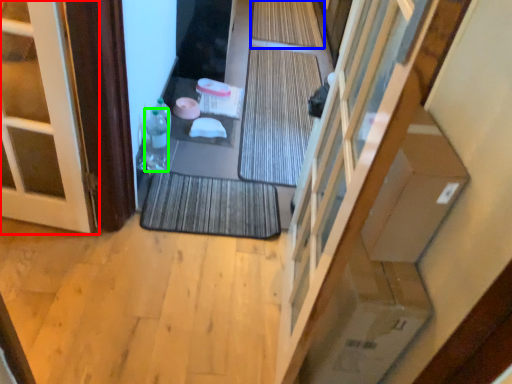
Question: Which object is positioned closest to door (highlighted by a red box)? Select from bath mat (highlighted by a blue box) and bottle (highlighted by a green box).

Choices:
 (A) bath mat
 (B) bottle

Answer: (B)